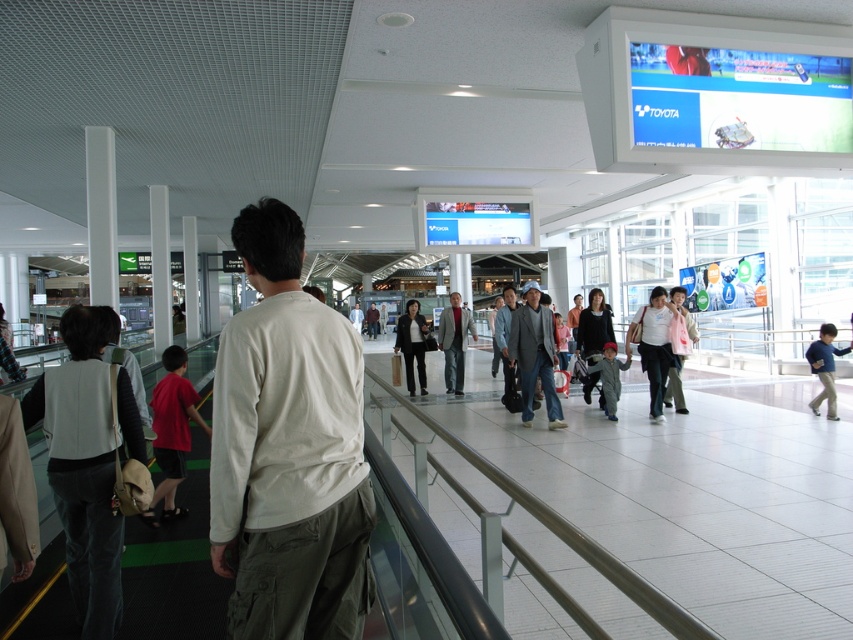
Is red cotton shirt at center to the left of red fabric child at center from the viewer's perspective?

Correct, you'll find red cotton shirt at center to the left of red fabric child at center.

Does point (206, 428) come farther from viewer compared to point (614, 380)?

No, it is in front of (614, 380).

Does point (171, 369) come closer to viewer compared to point (602, 364)?

That is True.

Locate an element on the screen. Image resolution: width=853 pixels, height=640 pixels. red cotton shirt at center is located at coordinates (171, 432).

Can you confirm if light gray fabric jacket at center is shorter than blue cotton shirt at right?

Incorrect, light gray fabric jacket at center's height does not fall short of blue cotton shirt at right's.

Is light gray fabric jacket at center to the right of blue cotton shirt at right from the viewer's perspective?

Incorrect, light gray fabric jacket at center is not on the right side of blue cotton shirt at right.

This screenshot has height=640, width=853. In order to click on light gray fabric jacket at center in this screenshot , I will do `click(454, 340)`.

Describe the element at coordinates (288, 449) in the screenshot. The height and width of the screenshot is (640, 853). I see `white matte shirt at center` at that location.

Which is behind, point (329, 436) or point (413, 339)?

The point (413, 339) is behind.

The image size is (853, 640). I want to click on white matte shirt at center, so [x=288, y=449].